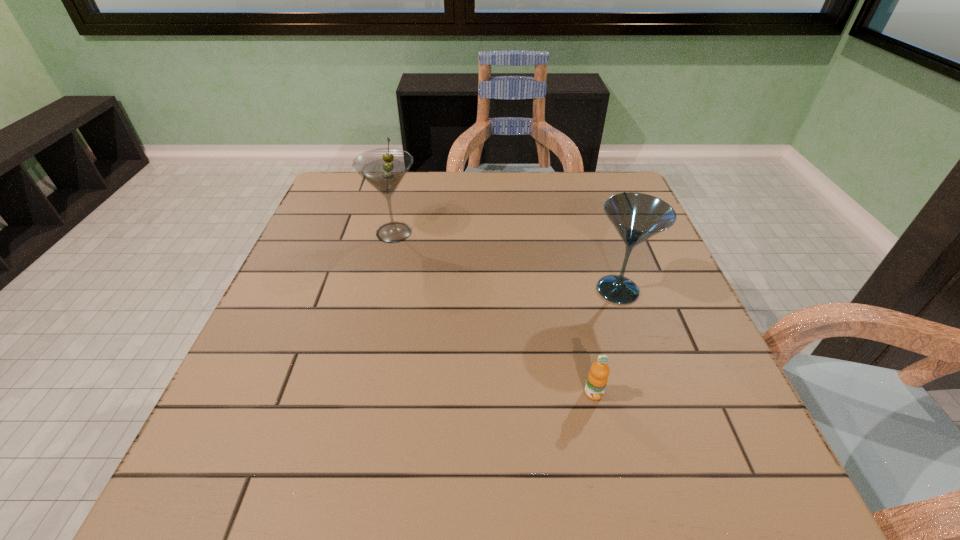
You are a GUI agent. You are given a task and a screenshot of the screen. Output one action in this format:
    pyautogui.click(x=<x>, y=<y>)
    Task: Click on the vacant space in between the second farthest object and the farther martini
    Image resolution: width=960 pixels, height=540 pixels.
    Given the screenshot: What is the action you would take?
    tap(506, 261)

Locate an element on the screen. free space between the left martini and the nearer martini is located at coordinates (506, 261).

You are a GUI agent. You are given a task and a screenshot of the screen. Output one action in this format:
    pyautogui.click(x=<x>, y=<y>)
    Task: Click on the free space between the nearer martini and the shortest object
    The height and width of the screenshot is (540, 960).
    Given the screenshot: What is the action you would take?
    pyautogui.click(x=606, y=342)

Image resolution: width=960 pixels, height=540 pixels. I want to click on empty space that is in between the farther martini and the nearest object, so click(x=493, y=313).

Locate an element on the screen. unoccupied area between the left martini and the second nearest object is located at coordinates (506, 261).

The width and height of the screenshot is (960, 540). In order to click on empty space that is in between the second object from left to right and the second nearest object in this screenshot , I will do `click(606, 342)`.

Select which object appears as the closest to the nearest object. Please provide its 2D coordinates. Your answer should be formatted as a tuple, i.e. [(x, y)], where the tuple contains the x and y coordinates of a point satisfying the conditions above.

[(637, 217)]

Point out which object is positioned as the second nearest to the rightmost object. Please provide its 2D coordinates. Your answer should be formatted as a tuple, i.e. [(x, y)], where the tuple contains the x and y coordinates of a point satisfying the conditions above.

[(384, 168)]

Where is `vacant area that satisfies the following two spatial constraints: 1. on the front side of the rightmost object; 2. on the left side of the left martini`? Image resolution: width=960 pixels, height=540 pixels. vacant area that satisfies the following two spatial constraints: 1. on the front side of the rightmost object; 2. on the left side of the left martini is located at coordinates (380, 290).

Identify the location of free location that satisfies the following two spatial constraints: 1. on the front side of the second nearest object; 2. on the right side of the leftmost object. The image size is (960, 540). (380, 290).